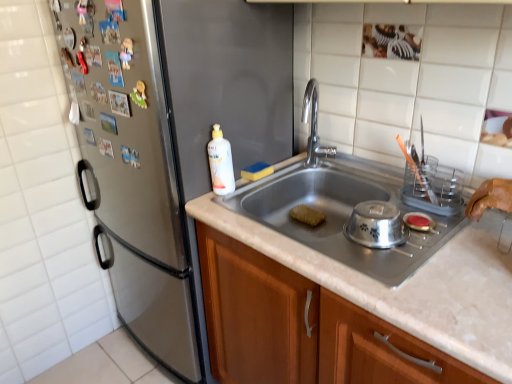
Question: Can you confirm if silver metallic bowl at sink is positioned to the left of polished stainless steel faucet at center?

Choices:
 (A) yes
 (B) no

Answer: (B)

Question: Does silver metallic bowl at sink have a larger size compared to polished stainless steel faucet at center?

Choices:
 (A) no
 (B) yes

Answer: (A)

Question: Can you confirm if silver metallic bowl at sink is positioned to the right of polished stainless steel faucet at center?

Choices:
 (A) yes
 (B) no

Answer: (A)

Question: Is silver metallic bowl at sink directly adjacent to polished stainless steel faucet at center?

Choices:
 (A) no
 (B) yes

Answer: (A)

Question: Is the depth of silver metallic bowl at sink less than that of polished stainless steel faucet at center?

Choices:
 (A) yes
 (B) no

Answer: (A)

Question: Considering the positions of point (259, 170) and point (289, 29), is point (259, 170) closer or farther from the camera than point (289, 29)?

Choices:
 (A) farther
 (B) closer

Answer: (A)

Question: From the image's perspective, is yellow sponge at sink, placed as the 2th food when sorted from bottom to top, located above or below satin silver refrigerator at left?

Choices:
 (A) above
 (B) below

Answer: (A)

Question: Is yellow sponge at sink, placed as the 2th food when sorted from bottom to top, wider or thinner than satin silver refrigerator at left?

Choices:
 (A) wide
 (B) thin

Answer: (B)

Question: Considering the relative positions of yellow sponge at sink, placed as the 2th food when sorted from bottom to top, and satin silver refrigerator at left in the image provided, is yellow sponge at sink, placed as the 2th food when sorted from bottom to top, to the left or to the right of satin silver refrigerator at left?

Choices:
 (A) right
 (B) left

Answer: (A)

Question: From a real-world perspective, is polished stainless steel faucet at center physically located above or below brown sponge at sink center, acting as the first food starting from the bottom?

Choices:
 (A) below
 (B) above

Answer: (B)

Question: From the image's perspective, is polished stainless steel faucet at center above or below brown sponge at sink center, acting as the first food starting from the bottom?

Choices:
 (A) above
 (B) below

Answer: (A)

Question: Considering the positions of polished stainless steel faucet at center and brown sponge at sink center, acting as the first food starting from the bottom, in the image, is polished stainless steel faucet at center bigger or smaller than brown sponge at sink center, acting as the first food starting from the bottom,?

Choices:
 (A) small
 (B) big

Answer: (B)

Question: From their relative heights in the image, would you say polished stainless steel faucet at center is taller or shorter than brown sponge at sink center, the 2th food viewed from the left?

Choices:
 (A) tall
 (B) short

Answer: (A)

Question: Is satin silver refrigerator at left inside the boundaries of brown sponge at sink center, acting as the first food starting from the bottom, or outside?

Choices:
 (A) inside
 (B) outside

Answer: (B)

Question: From the image's perspective, is satin silver refrigerator at left located above or below brown sponge at sink center, acting as the first food starting from the bottom?

Choices:
 (A) above
 (B) below

Answer: (A)